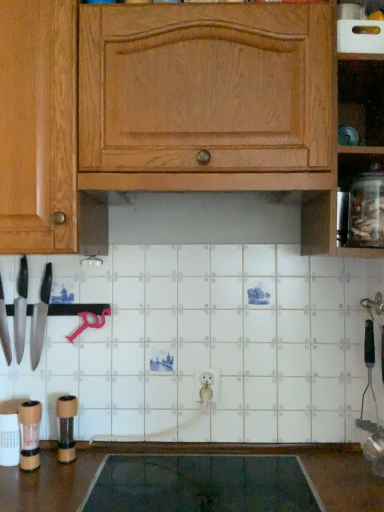
Question: Is clear glass jar at right oriented away from wooden pepper grinder at lower left, arranged as the 2th appliance when viewed from the right?

Choices:
 (A) no
 (B) yes

Answer: (A)

Question: Is the surface of clear glass jar at right in direct contact with wooden pepper grinder at lower left, which appears as the 1th appliance when viewed from the left?

Choices:
 (A) yes
 (B) no

Answer: (B)

Question: Is clear glass jar at right facing towards wooden pepper grinder at lower left, which appears as the 1th appliance when viewed from the left?

Choices:
 (A) yes
 (B) no

Answer: (B)

Question: Does clear glass jar at right have a larger size compared to wooden pepper grinder at lower left, which appears as the 1th appliance when viewed from the left?

Choices:
 (A) no
 (B) yes

Answer: (B)

Question: Considering the relative sizes of clear glass jar at right and wooden pepper grinder at lower left, which is counted as the second appliance, starting from the back, in the image provided, is clear glass jar at right thinner than wooden pepper grinder at lower left, which is counted as the second appliance, starting from the back,?

Choices:
 (A) no
 (B) yes

Answer: (A)

Question: Is wooden pepper grinder at lower left, the 1th appliance from the front, completely or partially inside clear glass jar at right?

Choices:
 (A) no
 (B) yes

Answer: (A)

Question: Does polished silver knife at left, the 2th knife viewed from the right, appear on the right side of shiny silver knife at left, which is the third knife in right-to-left order?

Choices:
 (A) no
 (B) yes

Answer: (B)

Question: Does polished silver knife at left, the 2th knife viewed from the right, have a greater width compared to shiny silver knife at left, which appears as the 1th knife when viewed from the left?

Choices:
 (A) no
 (B) yes

Answer: (A)

Question: Is polished silver knife at left, the 2th knife viewed from the right, not inside shiny silver knife at left, which appears as the 1th knife when viewed from the left?

Choices:
 (A) yes
 (B) no

Answer: (A)

Question: Are polished silver knife at left, the 2th knife viewed from the left, and shiny silver knife at left, which appears as the 1th knife when viewed from the left, located far from each other?

Choices:
 (A) no
 (B) yes

Answer: (A)

Question: Are polished silver knife at left, the 2th knife viewed from the right, and shiny silver knife at left, which is the third knife in right-to-left order, making contact?

Choices:
 (A) yes
 (B) no

Answer: (A)

Question: Is shiny silver knife at left, which is the third knife in right-to-left order, at the back of polished silver knife at left, the 2th knife viewed from the left?

Choices:
 (A) no
 (B) yes

Answer: (A)

Question: Considering the relative positions of wooden pepper grinder at lower left, which appears as the 1th appliance when viewed from the left, and matte black knife at left, the 1th knife when ordered from right to left, in the image provided, is wooden pepper grinder at lower left, which appears as the 1th appliance when viewed from the left, to the right of matte black knife at left, the 1th knife when ordered from right to left, from the viewer's perspective?

Choices:
 (A) yes
 (B) no

Answer: (A)